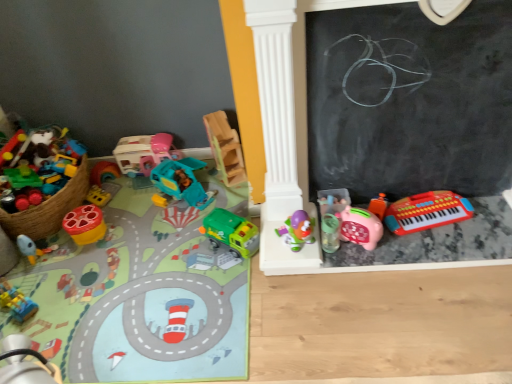
Locate an element on the screen. This screenshot has height=384, width=512. vacant area located to the right-hand side of plastic yellow car at lower left, arranged as the eleventh toy when viewed from the right is located at coordinates (63, 295).